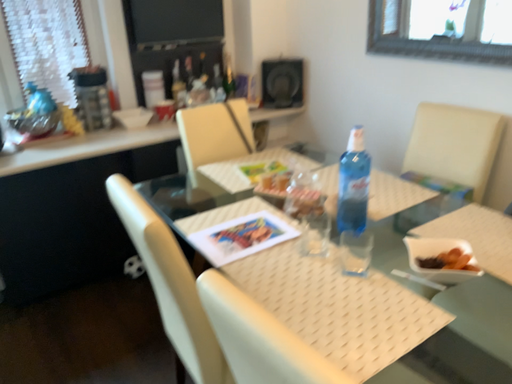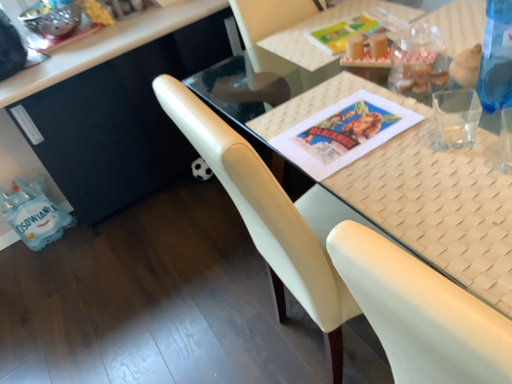
Question: Which way did the camera rotate in the video?

Choices:
 (A) rotated upward
 (B) rotated downward

Answer: (B)